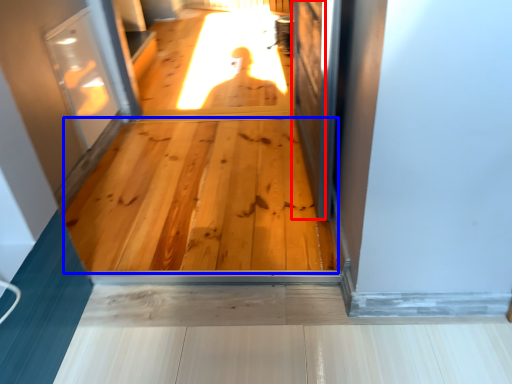
Question: Which object appears farthest to the camera in this image, screen door (highlighted by a red box) or hardwood (highlighted by a blue box)?

Choices:
 (A) screen door
 (B) hardwood

Answer: (B)